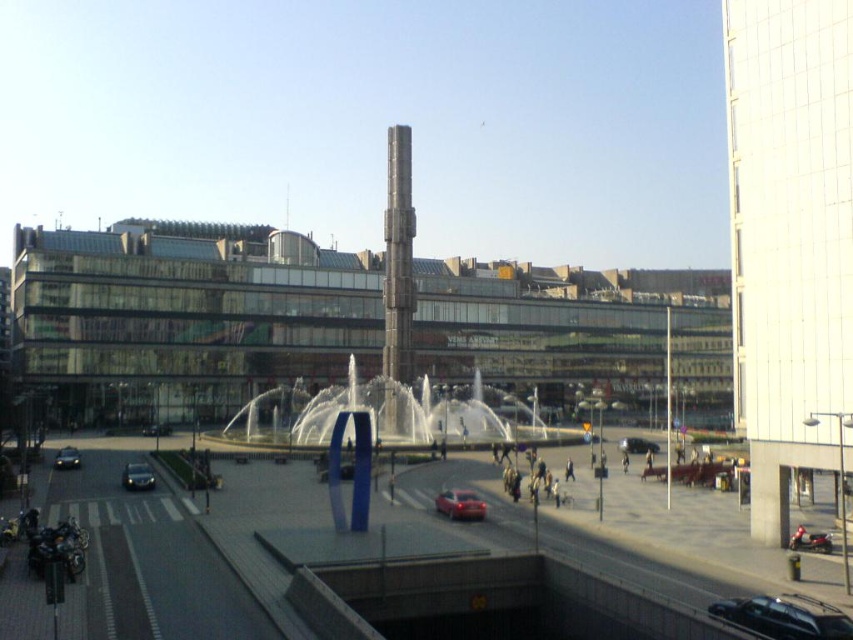
You are standing in the urban plaza and want to take a photo of the point at coordinates point (393, 182). If your camera has a maximum focus range of 300 feet, will you be able to focus on it?

The distance of point (393, 182) from the camera is 292.57 feet, which is within the camera maximum focus range of 300 feet. Therefore, you can focus on it.

You are standing in the plaza and want to take a photo of the white glass tower at right without the shiny black car at lower left blocking the view. Based on their positions, is it possible to do so?

The white glass tower at right is above the shiny black car at lower left, so if you position yourself so that you look upward towards the tower while avoiding the lower angle where the car is located, you can capture the tower without the car obstructing the view.